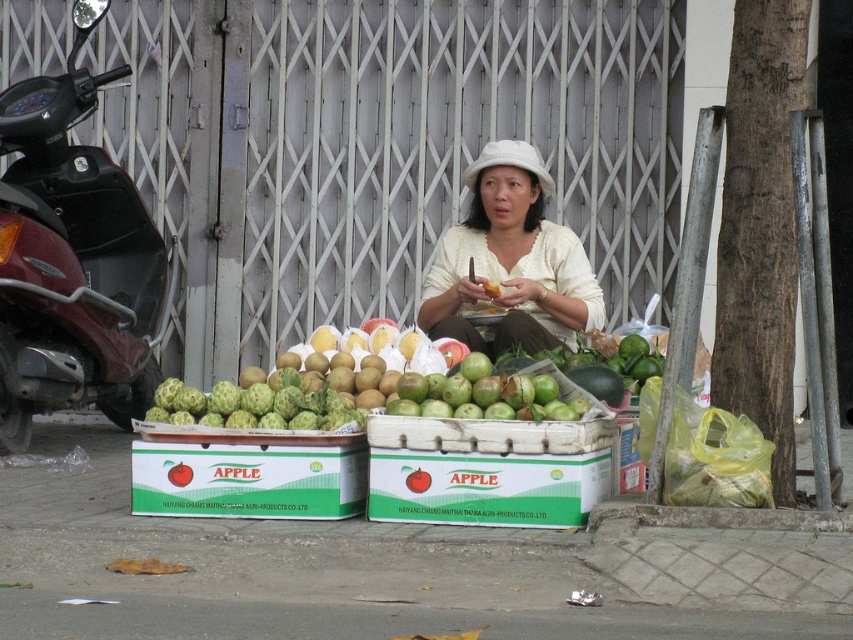
You are a customer looking to buy apples from the fruit stall. You notice the white matte hat at center and the green rough skin at center. Which item is taller?

The white matte hat at center is much taller than the green rough skin at center.

You are a customer at the fruit stall and want to buy the green rough skin at center. However, you notice that the white matte hat at center is blocking your view of it. Can you tell me which object is bigger so I can ask the seller to move the bigger one?

The white matte hat at center is larger in size than green rough skin at center, so you should ask the seller to move the white matte hat at center.

You are a delivery person who needs to place a package at point A and another package at point B. The coordinates for point A are given as point A is at (730,612). The coordinates for point B are at point B is at (495,257). If you start at point A, which direction should you move to reach point B?

To move from point A at (730,612) to point B at (495,257), you should move towards the lower left direction since point B is positioned behind point A according to the spatial relationship provided.